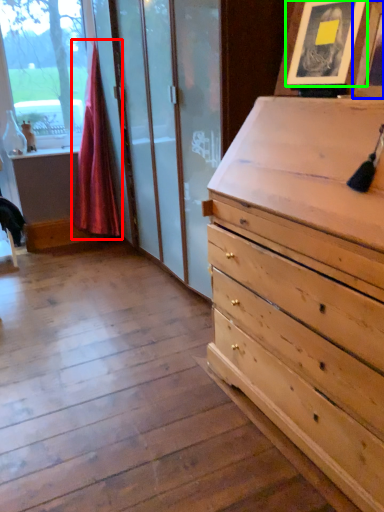
Question: Which is farther away from curtain (highlighted by a red box)? picture frame (highlighted by a blue box) or picture frame (highlighted by a green box)?

Choices:
 (A) picture frame
 (B) picture frame

Answer: (A)